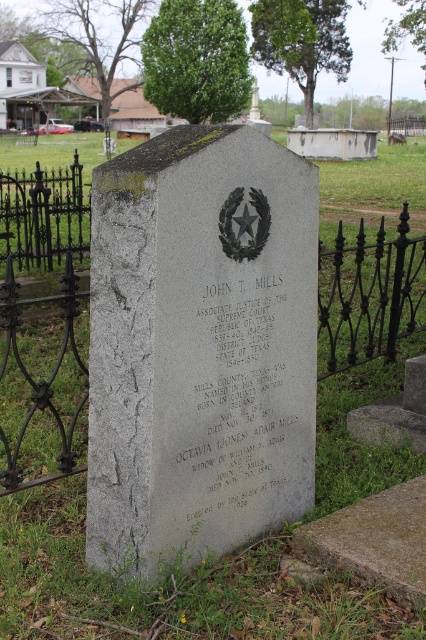
Does gray stone gravestone at center appear on the left side of gray stone plaque at center?

Indeed, gray stone gravestone at center is positioned on the left side of gray stone plaque at center.

Does gray stone gravestone at center appear on the right side of gray stone plaque at center?

In fact, gray stone gravestone at center is to the left of gray stone plaque at center.

Where is `gray stone gravestone at center`? The width and height of the screenshot is (426, 640). gray stone gravestone at center is located at coordinates (199, 346).

This screenshot has width=426, height=640. I want to click on gray stone gravestone at center, so click(x=199, y=346).

Who is lower down, gray stone gravestone at center or black wrought iron fence at left?

gray stone gravestone at center is below.

Can you confirm if gray stone gravestone at center is wider than black wrought iron fence at left?

In fact, gray stone gravestone at center might be narrower than black wrought iron fence at left.

Is point (135, 417) behind point (37, 276)?

No, it is not.

The width and height of the screenshot is (426, 640). I want to click on gray stone gravestone at center, so click(x=199, y=346).

Is gray stone gravestone at center thinner than black wrought iron fence at right?

Yes, gray stone gravestone at center is thinner than black wrought iron fence at right.

Between point (236, 508) and point (414, 284), which one is positioned in front?

Positioned in front is point (236, 508).

The height and width of the screenshot is (640, 426). Identify the location of gray stone gravestone at center. (199, 346).